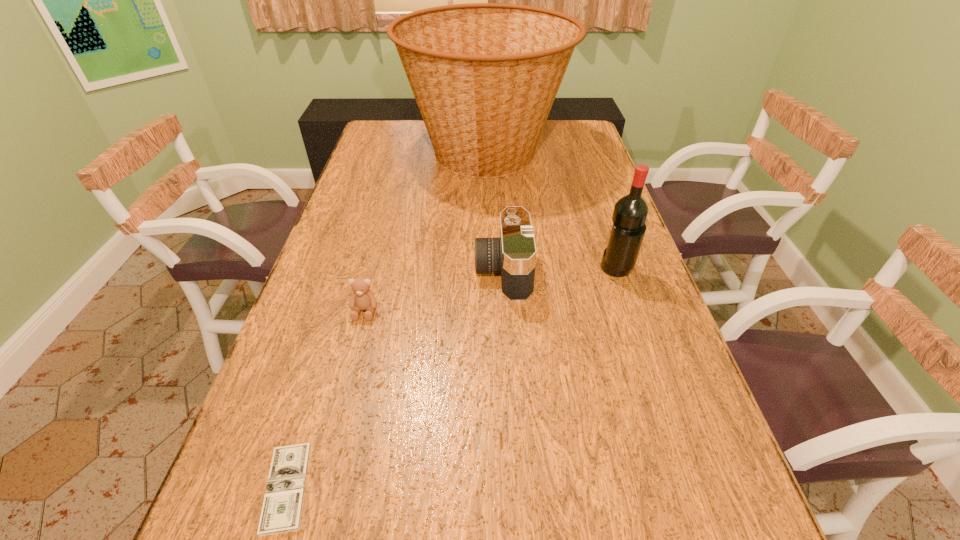
Locate an element on the screen. This screenshot has width=960, height=540. vacant area located on the front-facing side of the camera is located at coordinates (452, 271).

Find the location of a particular element. free space located on the front-facing side of the camera is located at coordinates (368, 271).

The width and height of the screenshot is (960, 540). I want to click on vacant space situated on the face of the fourth tallest object, so click(x=354, y=353).

Find the location of a particular element. The height and width of the screenshot is (540, 960). vacant space located 0.350m on the right of the shortest object is located at coordinates (516, 488).

Find the location of a particular element. The width and height of the screenshot is (960, 540). object situated at the far edge is located at coordinates (484, 75).

The width and height of the screenshot is (960, 540). In order to click on basket that is at the left edge in this screenshot , I will do `click(484, 75)`.

You are a GUI agent. You are given a task and a screenshot of the screen. Output one action in this format:
    pyautogui.click(x=<x>, y=<y>)
    Task: Click on the teddy bear that is at the left edge
    This screenshot has width=960, height=540.
    Given the screenshot: What is the action you would take?
    click(362, 298)

Where is `dollar that is at the left edge`? The image size is (960, 540). dollar that is at the left edge is located at coordinates pos(281,512).

Where is `basket situated at the right edge`? The width and height of the screenshot is (960, 540). basket situated at the right edge is located at coordinates (484, 75).

I want to click on wine bottle at the right edge, so click(x=630, y=212).